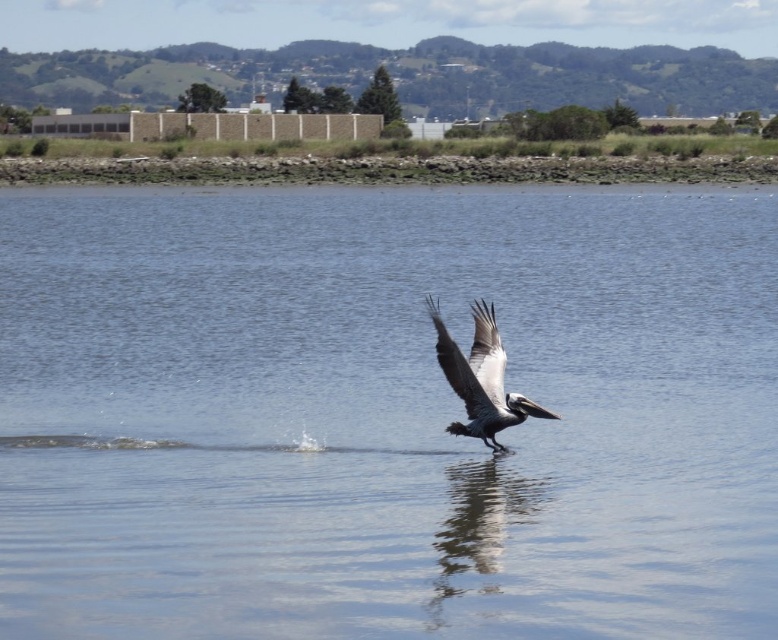
You are a photographer trying to capture the pelican in flight. You notice the clear water at center and the gray feathered wing at center. Which object is wider in the image?

The clear water at center is wider than the gray feathered wing at center according to the description.

In the scene shown: You are observing the pelican in flight over the water. There are two points marked in the scene. Which of these two points, point (535,410) or point (475,307), is closer to you?

Point (535,410) is closer to the camera than point (475,307).